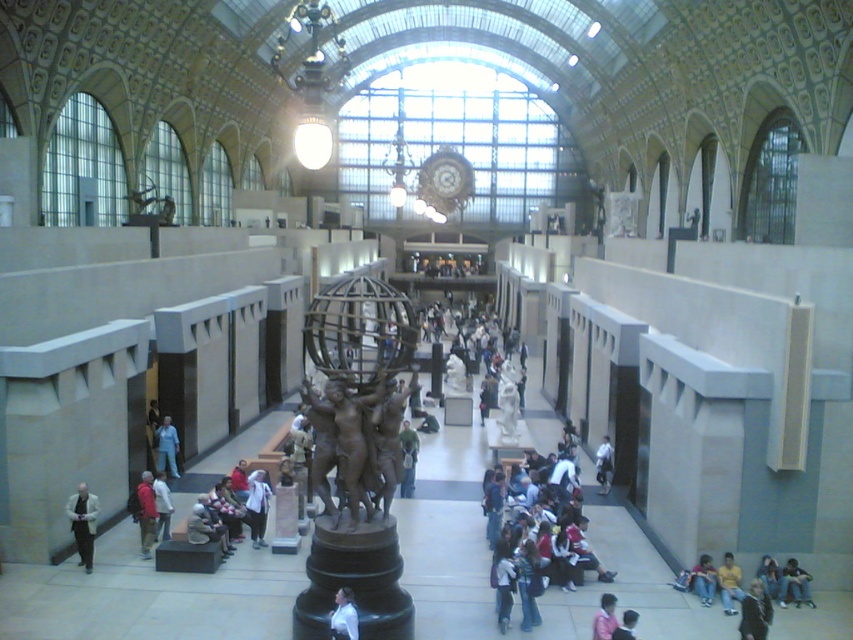
You are a visitor in the museum and you want to take a photo of both the light beige suit at lower left and the yellow fabric shirt at lower right. Since you are standing in the center of the room, which direction should you turn to first frame both items in your camera viewfinder?

You should turn to the left first to frame both the light beige suit at lower left and the yellow fabric shirt at lower right since the light beige suit at lower left is positioned to the left of the yellow fabric shirt at lower right.

You are an artist preparing to sketch the scene. You have two figures in the foreground wearing the light beige suit at lower left and the yellow fabric shirt at lower right. Which one should you draw first to ensure proper proportions in your sketch?

The light beige suit at lower left should be drawn first because it is bigger than the yellow fabric shirt at lower right, so starting with the larger figure ensures the proportions are correctly scaled in your sketch.